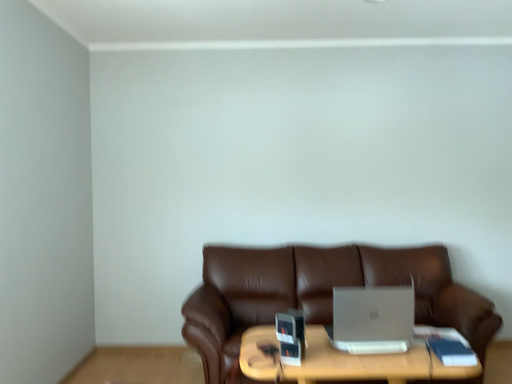
Locate an element on the screen. This screenshot has height=384, width=512. silver metallic laptop at center is located at coordinates click(x=372, y=319).

Does brown leather couch at center have a larger size compared to silver metallic laptop at center?

Yes.

Does brown leather couch at center lie in front of silver metallic laptop at center?

No, the depth of brown leather couch at center is greater than that of silver metallic laptop at center.

From the image's perspective, between brown leather couch at center and silver metallic laptop at center, who is located below?

brown leather couch at center.

Does brown leather couch at center turn towards wooden table at center?

Yes.

Which of these two, brown leather couch at center or wooden table at center, stands shorter?

wooden table at center.

Would you say brown leather couch at center contains wooden table at center?

No, wooden table at center is not surrounded by brown leather couch at center.

Between point (387, 371) and point (374, 256), which one is positioned in front?

The point (387, 371) is closer to the camera.

Is wooden table at center beside brown leather couch at center?

No, wooden table at center is not beside brown leather couch at center.

In the image, there is a brown leather couch at center. Find the location of `table below it (from a real-world perspective)`. table below it (from a real-world perspective) is located at coordinates (345, 359).

Considering the relative sizes of wooden table at center and brown leather couch at center in the image provided, is wooden table at center wider than brown leather couch at center?

Incorrect, the width of wooden table at center does not surpass that of brown leather couch at center.

From a real-world perspective, which is physically below, wooden table at center or silver metallic laptop at center?

wooden table at center.

Is wooden table at center smaller than silver metallic laptop at center?

Actually, wooden table at center might be larger than silver metallic laptop at center.

Does wooden table at center turn towards silver metallic laptop at center?

No.

Is wooden table at center placed right next to silver metallic laptop at center?

No, wooden table at center is not touching silver metallic laptop at center.

Where is `laptop positioned vertically above the wooden table at center (from a real-world perspective)`? The height and width of the screenshot is (384, 512). laptop positioned vertically above the wooden table at center (from a real-world perspective) is located at coordinates (372, 319).

In the image, is silver metallic laptop at center positioned in front of or behind wooden table at center?

Clearly, silver metallic laptop at center is behind wooden table at center.

Which object is positioned more to the right, silver metallic laptop at center or wooden table at center?

Positioned to the right is silver metallic laptop at center.

From the image's perspective, which is above, silver metallic laptop at center or wooden table at center?

silver metallic laptop at center appears higher in the image.

Identify the location of laptop above the brown leather couch at center (from the image's perspective). (372, 319).

Is silver metallic laptop at center to the left or to the right of brown leather couch at center in the image?

silver metallic laptop at center is positioned on brown leather couch at center's left side.

In the scene shown: Is silver metallic laptop at center oriented towards brown leather couch at center?

No, silver metallic laptop at center does not turn towards brown leather couch at center.

From a real-world perspective, is silver metallic laptop at center physically located above or below brown leather couch at center?

silver metallic laptop at center is above brown leather couch at center.

Where is `laptop in front of the brown leather couch at center`? laptop in front of the brown leather couch at center is located at coordinates (372, 319).

The height and width of the screenshot is (384, 512). In order to click on table lying below the brown leather couch at center (from the image's perspective) in this screenshot , I will do `click(345, 359)`.

Estimate the real-world distances between objects in this image. Which object is further from silver metallic laptop at center, wooden table at center or brown leather couch at center?

Among the two, brown leather couch at center is located further to silver metallic laptop at center.

When comparing their distances from brown leather couch at center, does wooden table at center or silver metallic laptop at center seem closer?

wooden table at center.

Looking at the image, which one is located closer to brown leather couch at center, silver metallic laptop at center or wooden table at center?

wooden table at center is positioned closer to the anchor brown leather couch at center.

Considering their positions, is brown leather couch at center positioned closer to wooden table at center than silver metallic laptop at center?

silver metallic laptop at center lies closer to wooden table at center than the other object.

Which object lies further to the anchor point silver metallic laptop at center, brown leather couch at center or wooden table at center?

The object further to silver metallic laptop at center is brown leather couch at center.

Estimate the real-world distances between objects in this image. Which object is closer to wooden table at center, silver metallic laptop at center or brown leather couch at center?

Among the two, silver metallic laptop at center is located nearer to wooden table at center.

Identify the location of laptop between wooden table at center and brown leather couch at center from front to back. (372, 319).